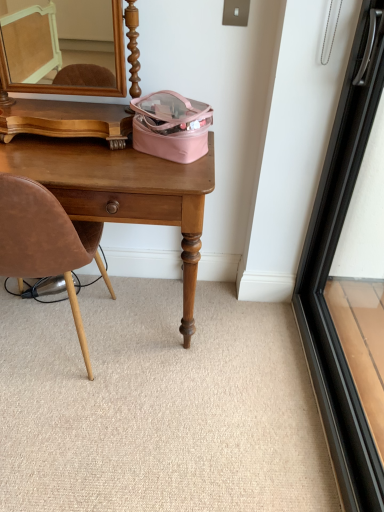
Find the location of a particular element. This screenshot has height=512, width=384. vacant area that lies between brown leather chair at left and wooden desk at center is located at coordinates point(140,369).